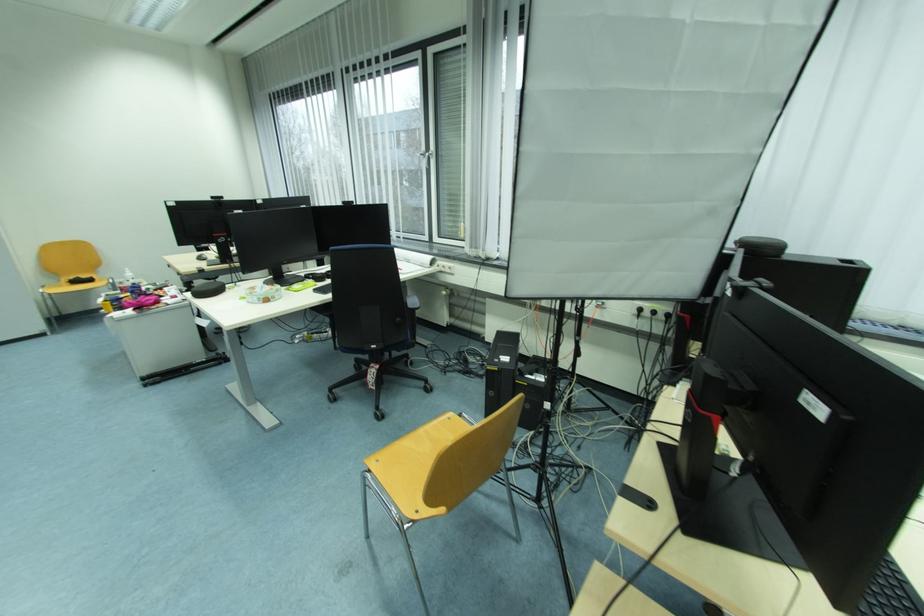
Identify the location of wooden chair sitting surface. (415, 456).